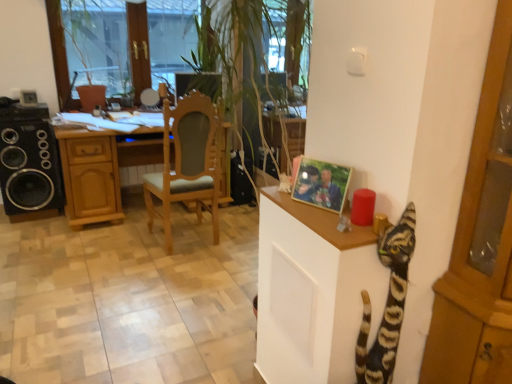
At what (x,y) coordinates should I click in order to perform the action: click on free spot in front of wooden desk at center. Please return your answer as a coordinate pair (x, y). The image size is (512, 384). Looking at the image, I should click on (110, 261).